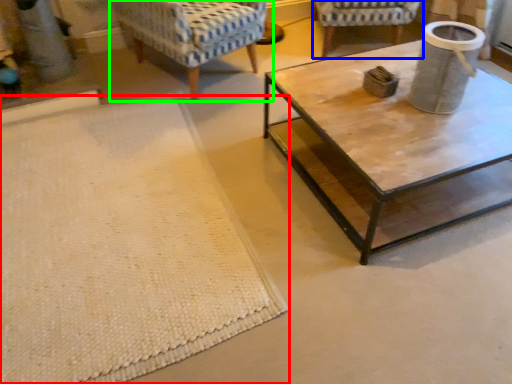
Question: Which object is positioned farthest from mat (highlighted by a red box)? Select from chair (highlighted by a blue box) and chair (highlighted by a green box).

Choices:
 (A) chair
 (B) chair

Answer: (A)